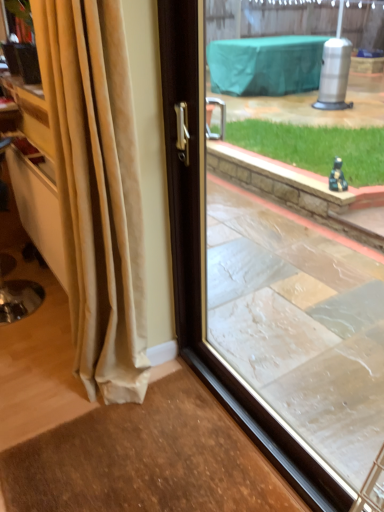
The height and width of the screenshot is (512, 384). What do you see at coordinates (97, 190) in the screenshot?
I see `beige velvet curtain at left` at bounding box center [97, 190].

The height and width of the screenshot is (512, 384). Identify the location of beige velvet curtain at left. (97, 190).

Describe the element at coordinates (269, 298) in the screenshot. I see `transparent glass window at center` at that location.

Where is `transparent glass window at center`? The height and width of the screenshot is (512, 384). transparent glass window at center is located at coordinates (269, 298).

Where is `beige velvet curtain at left`? The width and height of the screenshot is (384, 512). beige velvet curtain at left is located at coordinates (97, 190).

Which is more to the right, transparent glass window at center or beige velvet curtain at left?

transparent glass window at center.

Which object is further away from the camera taking this photo, transparent glass window at center or beige velvet curtain at left?

beige velvet curtain at left is behind.

Is point (220, 250) less distant than point (80, 268)?

No, it is not.

From the image's perspective, between transparent glass window at center and beige velvet curtain at left, which one is located above?

beige velvet curtain at left appears higher in the image.

From a real-world perspective, is transparent glass window at center positioned above or below beige velvet curtain at left?

Clearly, from a real-world perspective, transparent glass window at center is above beige velvet curtain at left.

Which of these two, transparent glass window at center or beige velvet curtain at left, is wider?

With larger width is beige velvet curtain at left.

Consider the image. Between transparent glass window at center and beige velvet curtain at left, which one has more height?

beige velvet curtain at left is taller.

In terms of size, does transparent glass window at center appear bigger or smaller than beige velvet curtain at left?

transparent glass window at center is smaller than beige velvet curtain at left.

Consider the image. Would you say transparent glass window at center contains beige velvet curtain at left?

No.

Is transparent glass window at center positioned far away from beige velvet curtain at left?

They are positioned close to each other.

Is beige velvet curtain at left at the back of transparent glass window at center?

That's not correct — transparent glass window at center is not looking away from beige velvet curtain at left.

Find the location of a particular element. curtain located underneath the transparent glass window at center (from a real-world perspective) is located at coordinates (97, 190).

Which is more to the right, beige velvet curtain at left or transparent glass window at center?

transparent glass window at center is more to the right.

Does beige velvet curtain at left come behind transparent glass window at center?

Yes, beige velvet curtain at left is further from the camera.

Considering the points (36, 2) and (262, 220), which point is in front, point (36, 2) or point (262, 220)?

The point (36, 2) is closer to the camera.

From the image's perspective, would you say beige velvet curtain at left is shown under transparent glass window at center?

Actually, beige velvet curtain at left appears above transparent glass window at center in the image.

From a real-world perspective, which object stands above the other?

transparent glass window at center is physically above.

Which object is wider, beige velvet curtain at left or transparent glass window at center?

beige velvet curtain at left is wider.

Can you confirm if beige velvet curtain at left is taller than transparent glass window at center?

Yes, beige velvet curtain at left is taller than transparent glass window at center.

Can you confirm if beige velvet curtain at left is bigger than transparent glass window at center?

Indeed, beige velvet curtain at left has a larger size compared to transparent glass window at center.

Is beige velvet curtain at left positioned beyond the bounds of transparent glass window at center?

That's correct, beige velvet curtain at left is outside of transparent glass window at center.

Can you see beige velvet curtain at left touching transparent glass window at center?

They are not placed beside each other.

Could you tell me if beige velvet curtain at left is turned towards transparent glass window at center?

No, beige velvet curtain at left is not turned towards transparent glass window at center.

How far apart are beige velvet curtain at left and transparent glass window at center?

A distance of 24.85 inches exists between beige velvet curtain at left and transparent glass window at center.

In order to click on curtain above the transparent glass window at center (from the image's perspective) in this screenshot , I will do `click(97, 190)`.

Image resolution: width=384 pixels, height=512 pixels. Identify the location of window located below the beige velvet curtain at left (from the image's perspective). (269, 298).

Identify the location of curtain lying behind the transparent glass window at center. (97, 190).